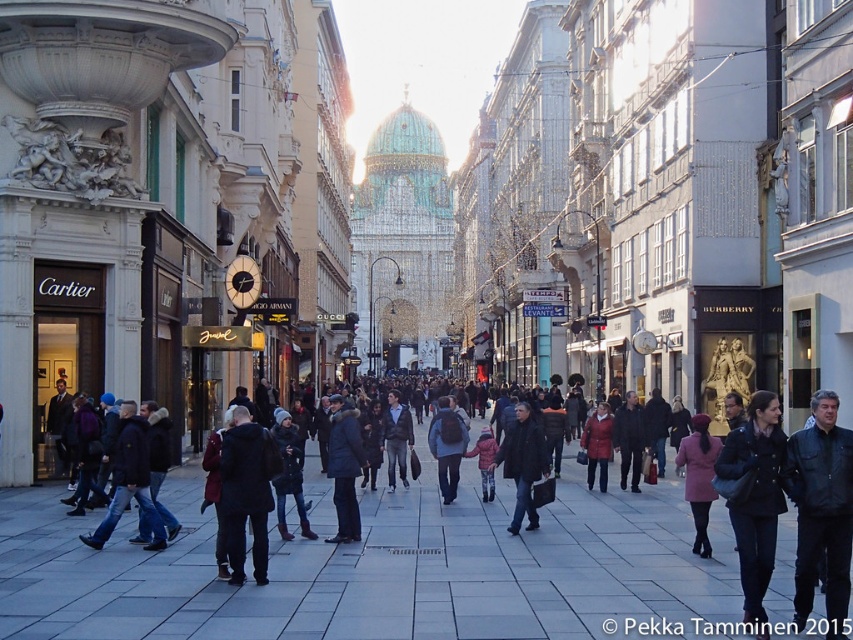
You are a photographer standing on the bustling urban street scene. You want to take a photo of both the black leather jacket at center and the blue backpack at center. Which object should you focus on first to ensure both are in clear view?

The black leather jacket at center is closer to the viewer than the blue backpack at center, so you should focus on the black leather jacket at center first to ensure both are in clear view.

You are standing on the bustling urban street scene in front of the Cartier and Gucci stores. You notice two points marked on the ground at coordinates point (833, 604) and point (445, 438). If you want to step closer to the camera, which point should you move towards?

Point (833, 604) is closer to the camera than point (445, 438), so you should move towards point (833, 604) to get closer to the camera.